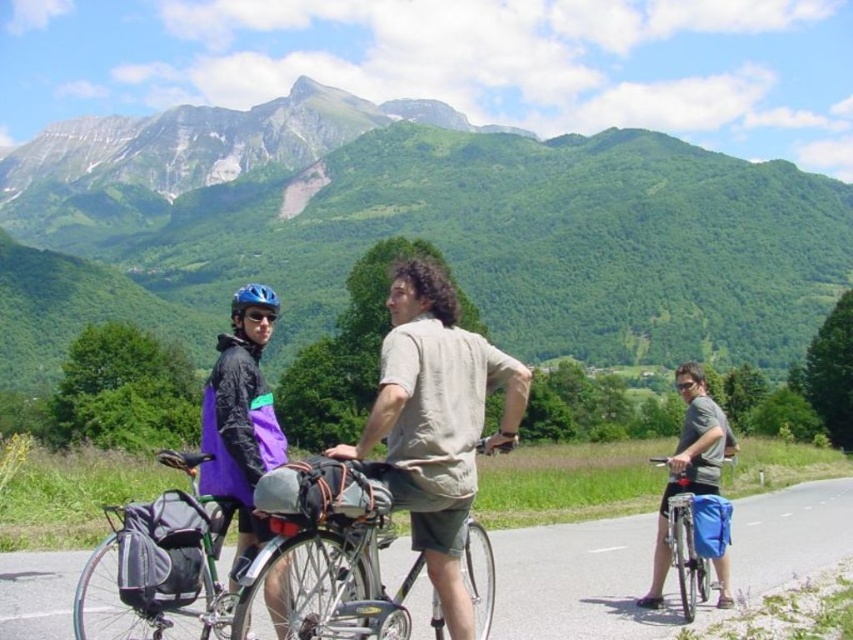
Does metallic bicycle at center have a greater height compared to blue matte bicycle helmet at upper left?

No, metallic bicycle at center is not taller than blue matte bicycle helmet at upper left.

Does point (621, 540) lie behind point (245, 284)?

No, it is not.

Which is in front, point (555, 589) or point (239, 296)?

Point (239, 296) is in front.

Find the location of `metallic bicycle at center`. metallic bicycle at center is located at coordinates (578, 580).

From the picture: Can you confirm if metallic bicycle at center is positioned to the left of silver metallic bicycle at center?

Incorrect, metallic bicycle at center is not on the left side of silver metallic bicycle at center.

Does metallic bicycle at center have a larger size compared to silver metallic bicycle at center?

Yes, metallic bicycle at center is bigger than silver metallic bicycle at center.

Is point (62, 564) positioned in front of point (422, 566)?

No, it is behind (422, 566).

Locate an element on the screen. metallic bicycle at center is located at coordinates coord(578,580).

Is the position of green grassy mountain at upper center less distant than that of blue matte bicycle helmet at upper left?

No, green grassy mountain at upper center is behind blue matte bicycle helmet at upper left.

Who is taller, green grassy mountain at upper center or blue matte bicycle helmet at upper left?

Standing taller between the two is green grassy mountain at upper center.

What do you see at coordinates (450, 221) in the screenshot?
I see `green grassy mountain at upper center` at bounding box center [450, 221].

Locate an element on the screen. The width and height of the screenshot is (853, 640). green grassy mountain at upper center is located at coordinates (450, 221).